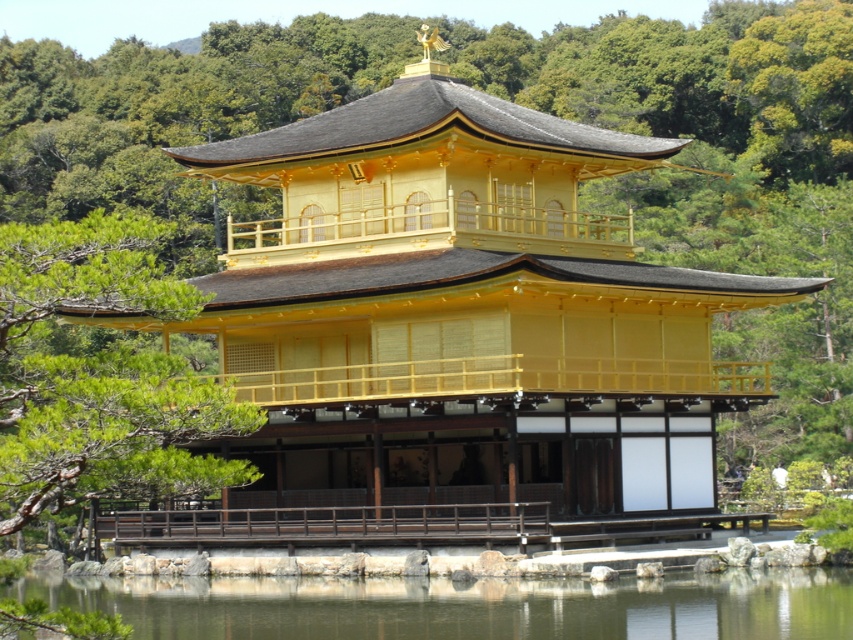
Between green leafy tree at center and transparent water at lower center, which one is positioned lower?

transparent water at lower center is below.

Is point (120, 280) farther from camera compared to point (396, 625)?

No, (120, 280) is closer to viewer.

Where is `green leafy tree at center`? The height and width of the screenshot is (640, 853). green leafy tree at center is located at coordinates (100, 376).